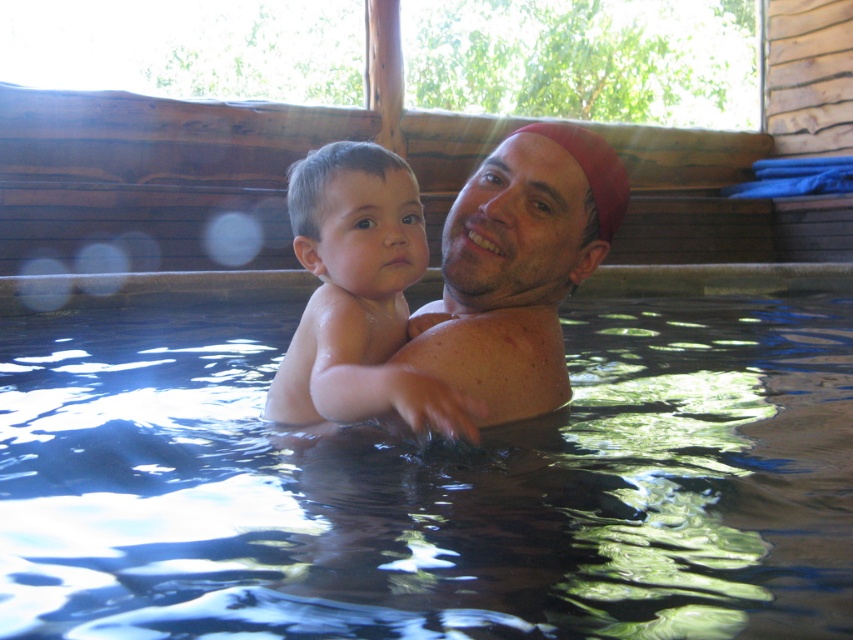
You are a photographer trying to capture the reflection of the transparent water at center and the smooth skin baby at center in this hot tub scene. Which object will have a larger reflection on the water surface?

The transparent water at center has a larger size than the smooth skin baby at center, so its reflection on the water surface will also be larger.

You are a lifeguard on duty and notice the transparent water at center and the smooth skin baby at center in the hot tub. Based on their positions, is the baby fully submerged in the water or partially submerged?

The transparent water at center is much taller than the smooth skin baby at center, meaning the water reaches higher than the baby, so the baby is fully submerged in the water.

You are a safety inspector checking the hot tub. You need to ensure that the transparent water at center is not covering the matte skin at center above it. Is this current setup compliant with safety standards?

The transparent water at center is below matte skin at center, so the water is not covering the skin above it, which complies with safety standards.